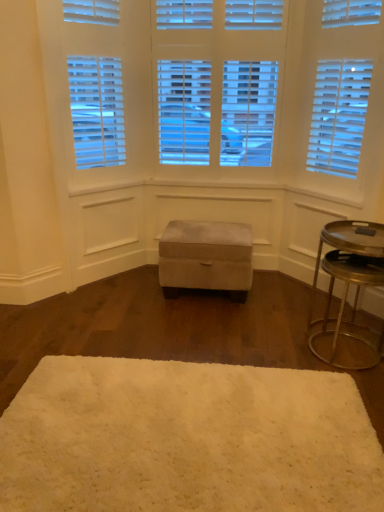
You are a GUI agent. You are given a task and a screenshot of the screen. Output one action in this format:
    pyautogui.click(x=<x>, y=<y>)
    Task: Click on the free location above white fluffy rug at center (from a real-world perspective)
    This screenshot has height=512, width=384.
    Given the screenshot: What is the action you would take?
    pyautogui.click(x=182, y=436)